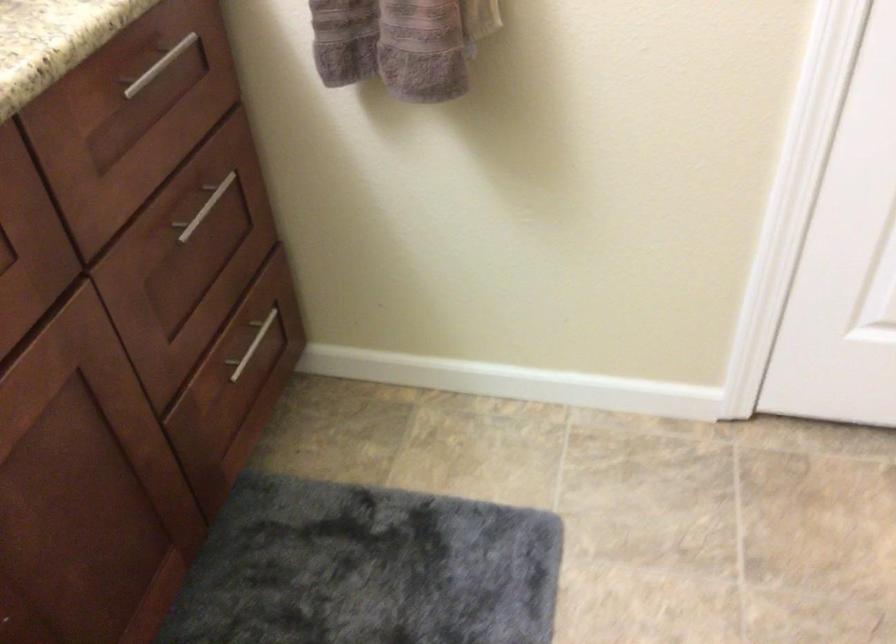
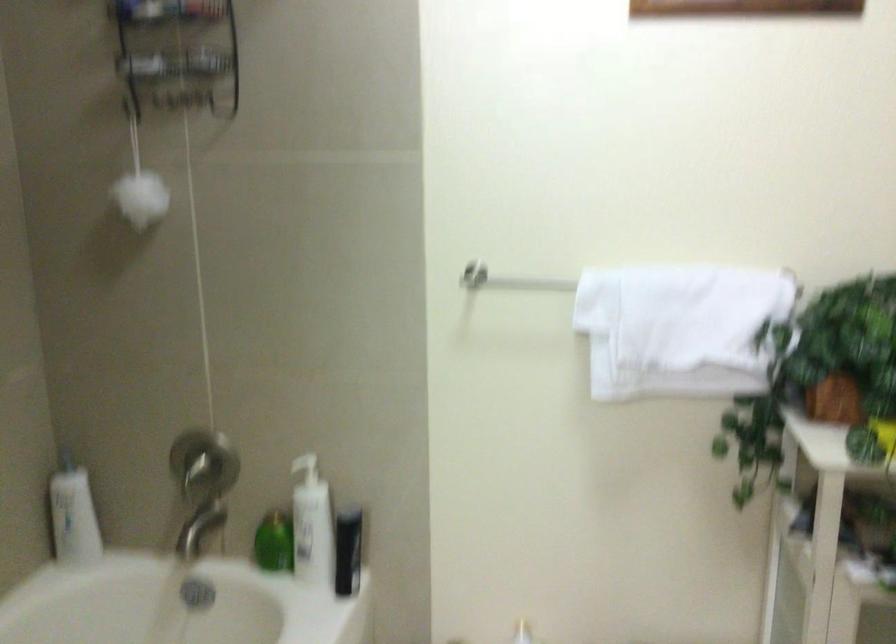
Question: The first image is from the beginning of the video and the second image is from the end. How did the camera likely rotate when shooting the video?

Choices:
 (A) Left
 (B) Right
 (C) Up
 (D) Down

Answer: (B)